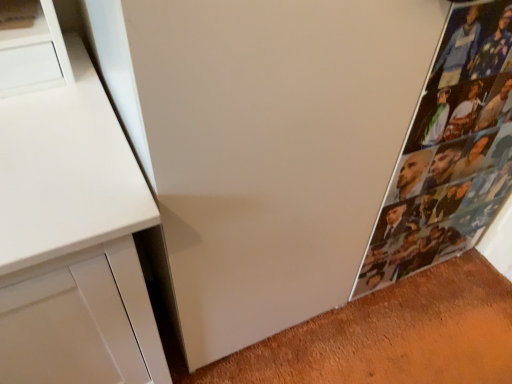
Question: Should I look upward or downward to see printed paper collage at right?

Choices:
 (A) down
 (B) up

Answer: (B)